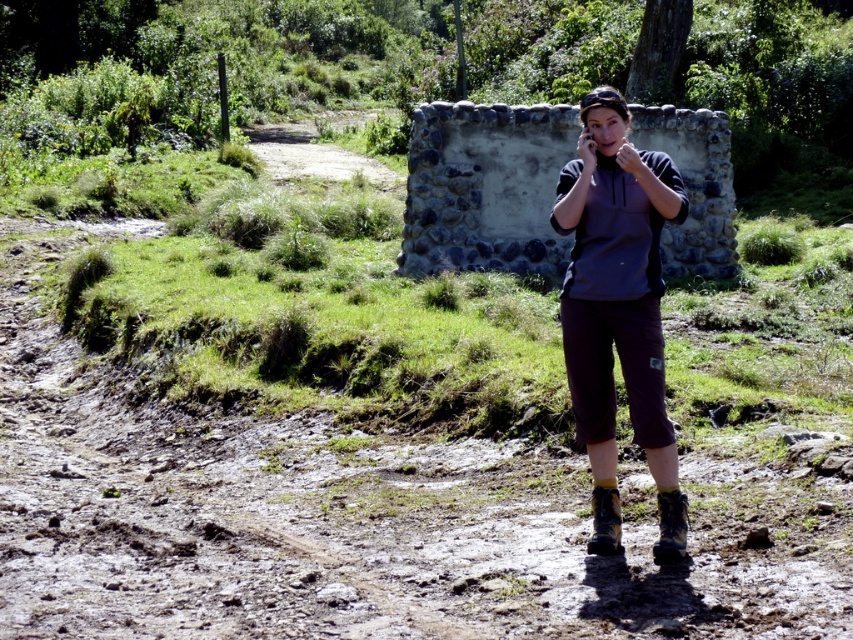
Question: Is dusty brown dirt track at lower left above dark gray fleece at center?

Choices:
 (A) no
 (B) yes

Answer: (A)

Question: Does leather boot at lower center appear over black suede boot at lower center?

Choices:
 (A) yes
 (B) no

Answer: (A)

Question: In this image, where is dark gray fleece at center located relative to black suede boot at lower center?

Choices:
 (A) right
 (B) left

Answer: (A)

Question: Based on their relative distances, which object is nearer to the dusty brown dirt track at lower left?

Choices:
 (A) dark gray fleece at center
 (B) leather boot at lower center

Answer: (B)

Question: Which object is the farthest from the dusty brown dirt track at lower left?

Choices:
 (A) black suede boot at lower center
 (B) dark gray fleece at center
 (C) leather boot at lower center

Answer: (B)

Question: Which of the following is the closest to the observer?

Choices:
 (A) (599, 524)
 (B) (608, 330)
 (C) (195, 618)
 (D) (677, 538)

Answer: (C)